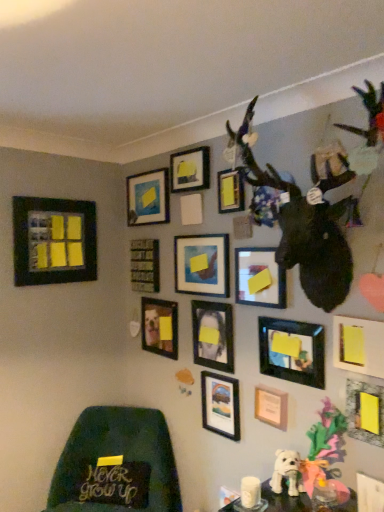
Question: Looking at the image, does white plush dog at lower center seem bigger or smaller compared to matte black picture frame at upper center, which appears as the thirteenth picture frame when viewed from the right?

Choices:
 (A) big
 (B) small

Answer: (A)

Question: Would you say white plush dog at lower center is to the left or to the right of matte black picture frame at upper center, which appears as the thirteenth picture frame when viewed from the right, in the picture?

Choices:
 (A) right
 (B) left

Answer: (A)

Question: Which is nearer to the matte black fabric at lower left?

Choices:
 (A) matte black picture frame at center, the tenth picture frame from the left
 (B) matte blue painting at center, the 10th picture frame viewed from the right
 (C) dark green fabric chair at lower left
 (D) matte black picture frame at upper left, the fifteenth picture frame viewed from the right
 (E) matte black picture frame at lower right, which is the fifth picture frame from right to left

Answer: (C)

Question: Which is farther from the matte black picture frame at lower right, positioned as the twelfth picture frame in left-to-right order?

Choices:
 (A) wooden picture frame at lower right, the 14th picture frame when ordered from left to right
 (B) matte black fabric at lower left
 (C) matte black picture frame at lower right, the eleventh picture frame viewed from the left
 (D) black matte picture frame at center, the 2th picture frame viewed from the left
 (E) matte black picture frame at upper center, the 7th picture frame positioned from the right

Answer: (B)